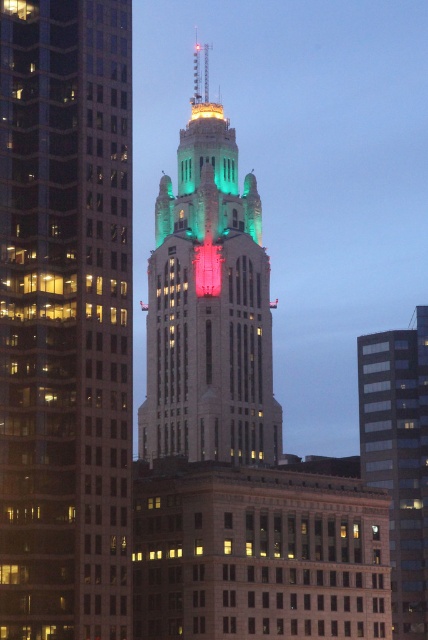
Question: Which of the following is the closest to the observer?

Choices:
 (A) glassy reflective skyscraper at center
 (B) green stone tower at center

Answer: (A)

Question: Is green glass skyscraper at center smaller than glassy reflective skyscraper at center?

Choices:
 (A) yes
 (B) no

Answer: (A)

Question: Can you confirm if green glass skyscraper at center is thinner than green stone tower at center?

Choices:
 (A) yes
 (B) no

Answer: (A)

Question: Among these points, which one is nearest to the camera?

Choices:
 (A) (418, 317)
 (B) (44, 388)

Answer: (B)

Question: Does green stone tower at center have a lesser width compared to glassy reflective skyscraper at center?

Choices:
 (A) no
 (B) yes

Answer: (B)

Question: Which point appears closest to the camera in this image?

Choices:
 (A) (x=92, y=152)
 (B) (x=388, y=408)
 (C) (x=247, y=408)

Answer: (A)